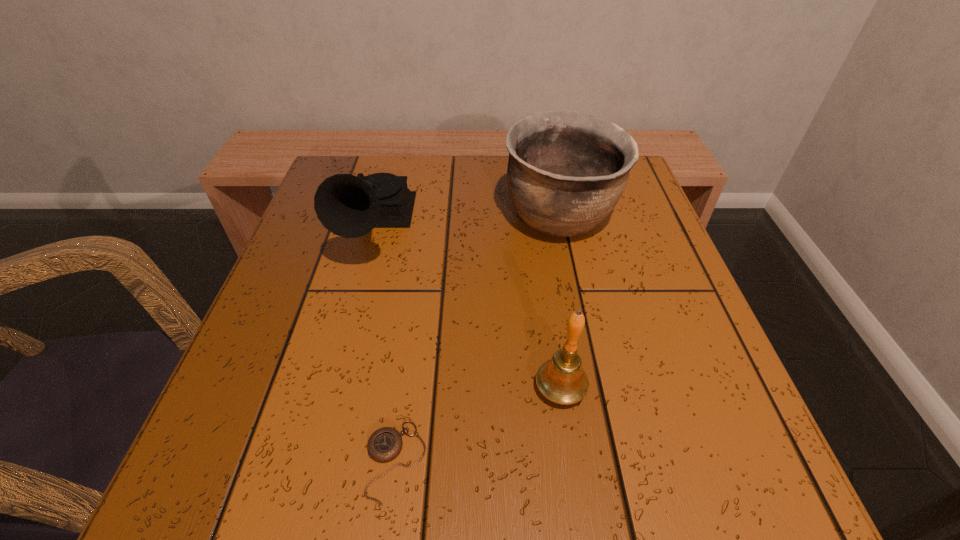
I want to click on blank region between the phonograph_record and the third farthest object, so click(467, 309).

Find the location of a particular element. This screenshot has width=960, height=540. free space between the pocket watch and the phonograph_record is located at coordinates (384, 346).

Find the location of a particular element. free space that is in between the phonograph_record and the nearest object is located at coordinates (384, 346).

What are the coordinates of `vacant space in between the shortest object and the third farthest object` in the screenshot? It's located at (478, 425).

This screenshot has width=960, height=540. Find the location of `vacant area between the phonograph_record and the pottery`. vacant area between the phonograph_record and the pottery is located at coordinates (467, 225).

At what (x,y) coordinates should I click in order to perform the action: click on vacant point located between the third farthest object and the nearest object. Please return your answer as a coordinate pair (x, y). The image size is (960, 540). Looking at the image, I should click on (478, 425).

You are a GUI agent. You are given a task and a screenshot of the screen. Output one action in this format:
    pyautogui.click(x=<x>, y=<y>)
    Task: Click on the free space between the phonograph_record and the bell
    
    Given the screenshot: What is the action you would take?
    pyautogui.click(x=467, y=309)

At what (x,y) coordinates should I click in order to perform the action: click on empty space that is in between the bell and the phonograph_record. Please return your answer as a coordinate pair (x, y). This screenshot has height=540, width=960. Looking at the image, I should click on (467, 309).

Where is `unoccupied position between the third farthest object and the phonograph_record`? The width and height of the screenshot is (960, 540). unoccupied position between the third farthest object and the phonograph_record is located at coordinates (467, 309).

The image size is (960, 540). What are the coordinates of `object that stands as the third closest to the bell` in the screenshot? It's located at (349, 206).